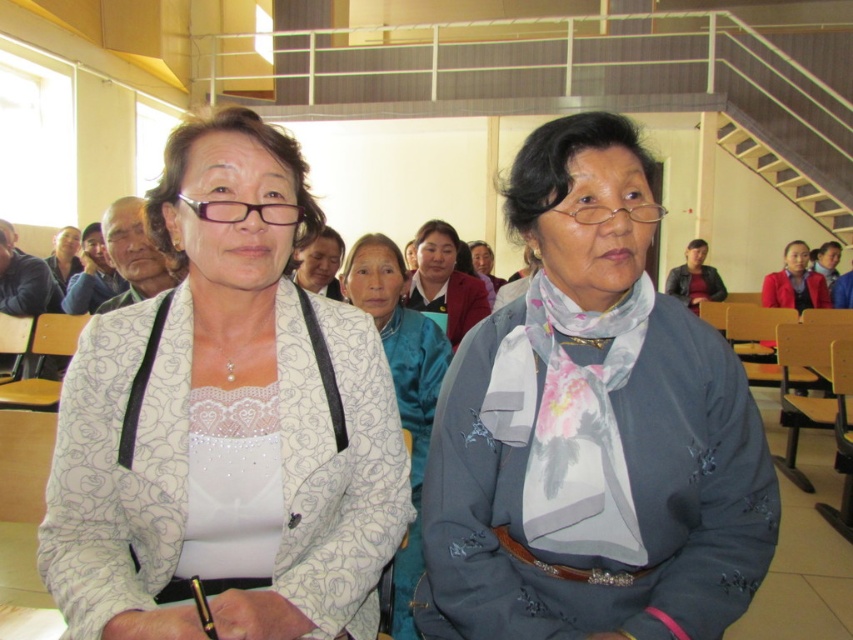
Question: In this image, where is blue silk scarf at center located relative to matte black jacket at upper left?

Choices:
 (A) below
 (B) above

Answer: (A)

Question: Observing the image, what is the correct spatial positioning of gray fabric scarf at center in reference to matte gray scarf at center?

Choices:
 (A) below
 (B) above

Answer: (A)

Question: Which point is farther to the camera?

Choices:
 (A) blue silk blouse at center
 (B) blue silk scarf at center
 (C) matte black jacket at upper left
 (D) matte gray scarf at center

Answer: (C)

Question: Which object appears closest to the camera in this image?

Choices:
 (A) gray fabric scarf at center
 (B) leather jacket at center

Answer: (A)

Question: Among these objects, which one is nearest to the camera?

Choices:
 (A) blue silk blouse at center
 (B) matte black jacket at upper left

Answer: (A)

Question: Does leather jacket at center have a lesser width compared to matte gray scarf at center?

Choices:
 (A) no
 (B) yes

Answer: (A)